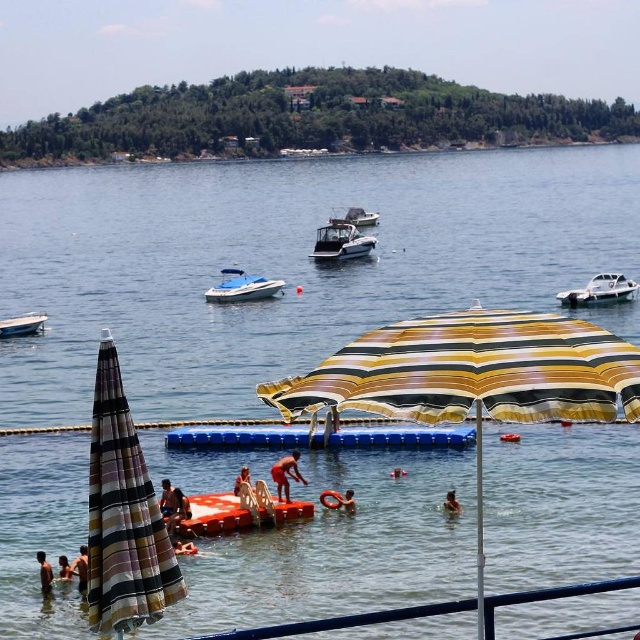
Based on the coordinates provided, which object is positioned at point (124, 515)?

The striped fabric umbrella at left is positioned at point (124, 515).

You are a photographer trying to capture a photo of the tan skin human at lower left without the striped fabric umbrella at left blocking the view. Can you adjust your position to achieve this?

The striped fabric umbrella at left is above the tan skin human at lower left, so if you move to a position where the human is not directly under the umbrella, you can avoid the obstruction. For example, moving to the right side of the human might allow you to capture the photo without the umbrella blocking the view.

Based on the coordinates provided, where is the striped fabric umbrella at left located in the image?

The striped fabric umbrella at left is located at the point with coordinates 0.806 on the x axis and 0.194 on the y axis.